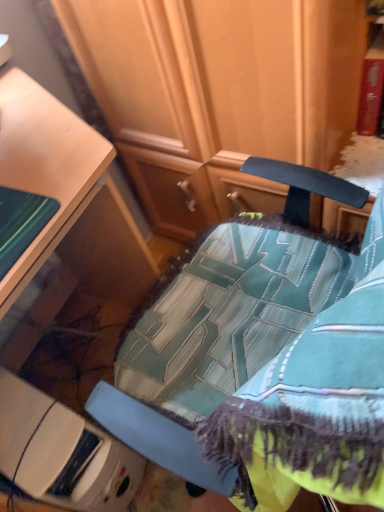
This screenshot has height=512, width=384. I want to click on blank space above white plastic container at lower left (from a real-world perspective), so click(x=22, y=439).